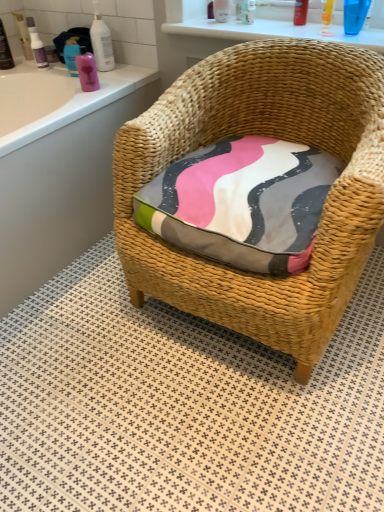
Locate an element on the screen. vacant space to the right of pink glossy bottle at upper left, the fourth toiletry viewed from the left is located at coordinates (119, 74).